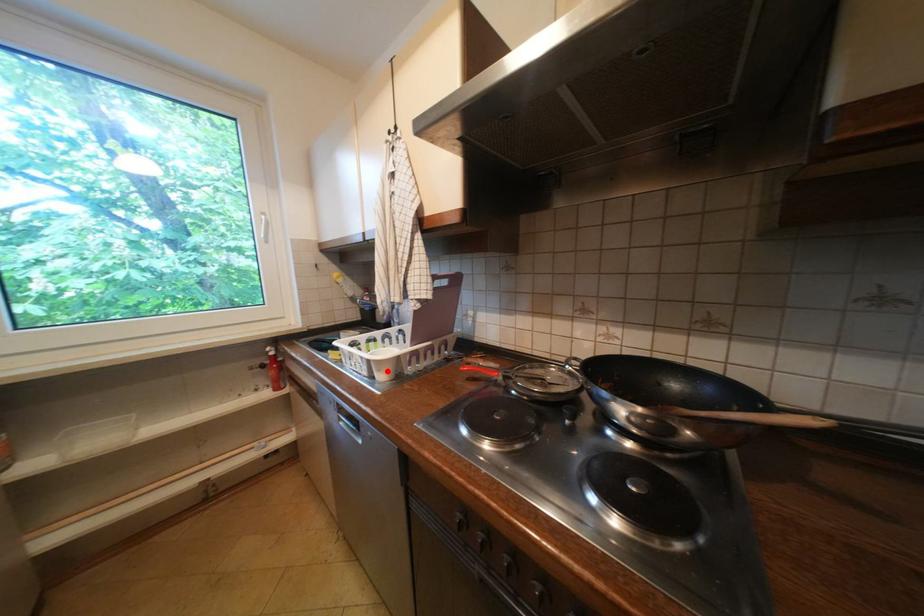
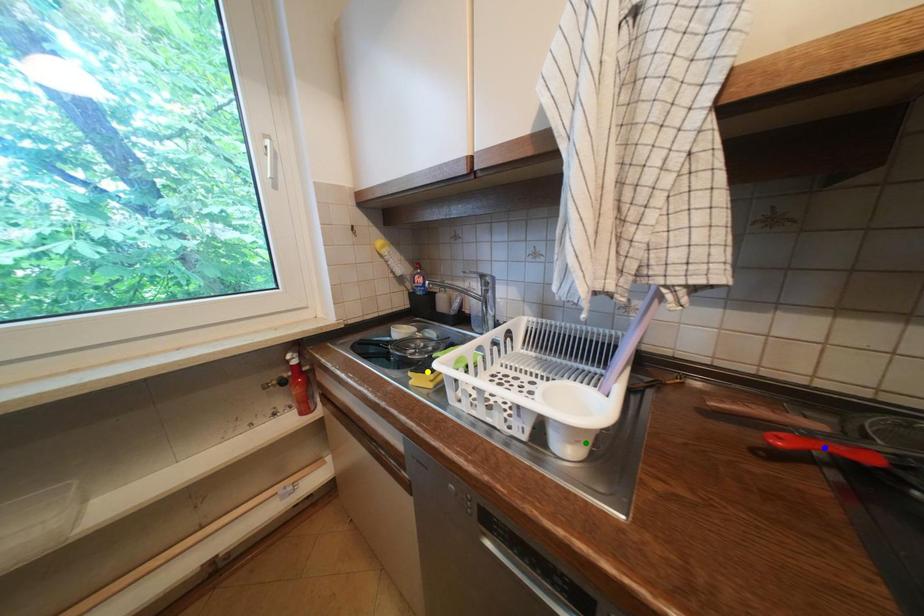
Question: I am providing you with two images of the same scene from different viewpoints. A red point is marked on the first image. You are given multiple points on the second image. Which mark in image 2 goes with the point in image 1?

Choices:
 (A) blue point
 (B) green point
 (C) yellow point

Answer: (B)